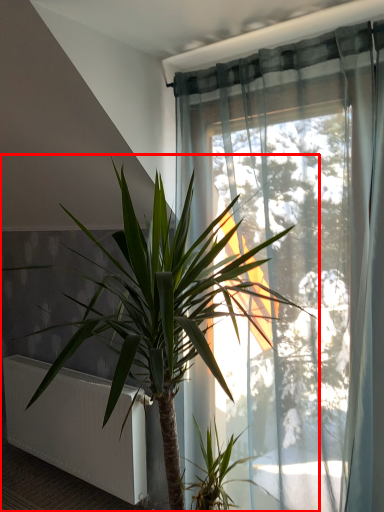
Question: From the image's perspective, considering the relative positions of houseplant (annotated by the red box) and radiator in the image provided, where is houseplant (annotated by the red box) located with respect to the staircase?

Choices:
 (A) above
 (B) below

Answer: (A)